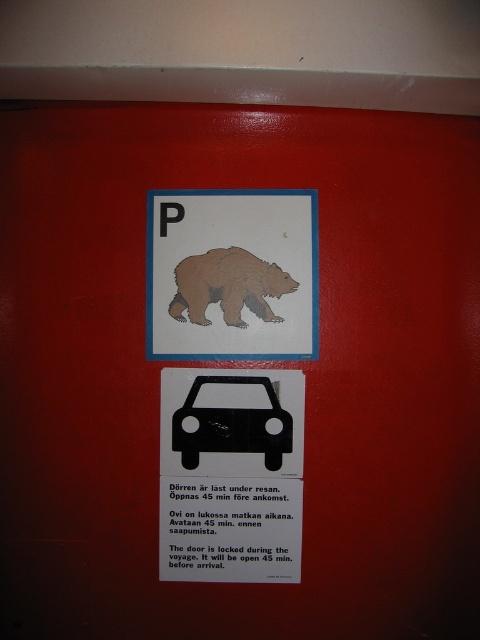
Question: Which is nearer to the cardboard bear at upper center?

Choices:
 (A) brown cardboard bear at center
 (B) black matte car at center

Answer: (A)

Question: Is cardboard bear at upper center in front of brown cardboard bear at center?

Choices:
 (A) no
 (B) yes

Answer: (B)

Question: Which point appears closest to the camera in this image?

Choices:
 (A) (228, 380)
 (B) (201, 268)
 (C) (269, 291)

Answer: (A)

Question: Does cardboard bear at upper center have a lesser width compared to black matte car at center?

Choices:
 (A) yes
 (B) no

Answer: (B)

Question: Which is farther from the black matte car at center?

Choices:
 (A) cardboard bear at upper center
 (B) brown cardboard bear at center

Answer: (B)

Question: Does brown cardboard bear at center have a lesser width compared to black matte car at center?

Choices:
 (A) yes
 (B) no

Answer: (B)